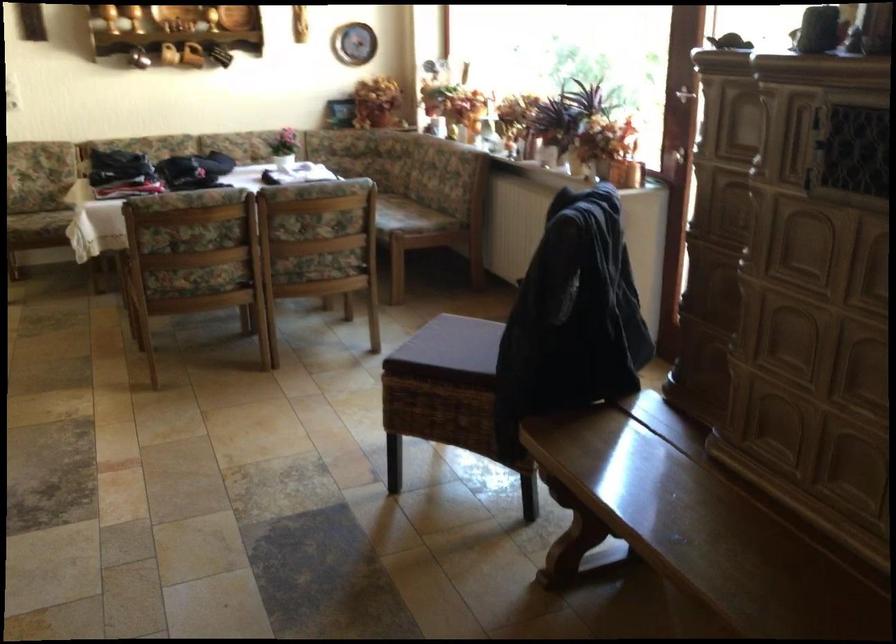
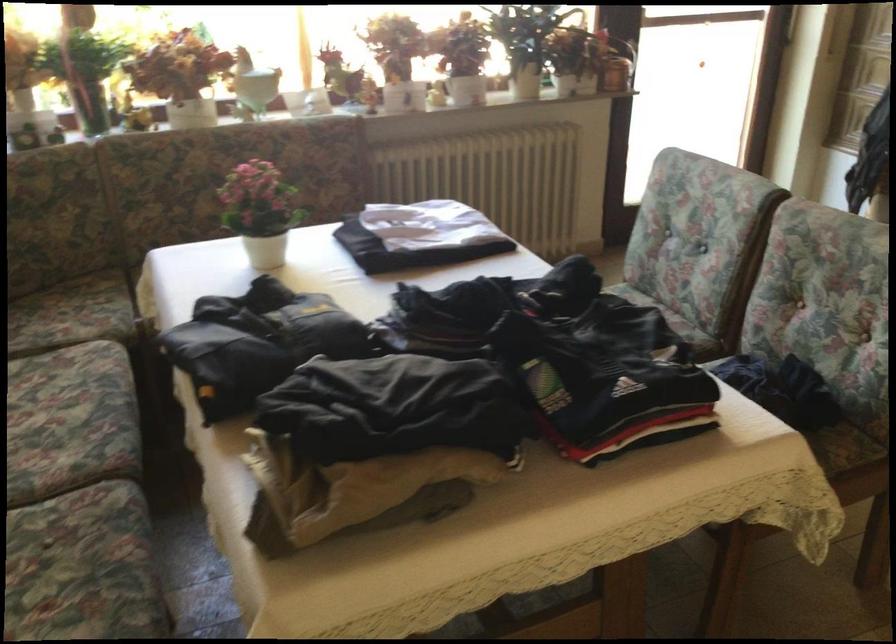
Where in the second image is the point corresponding to [394,84] from the first image?

(83, 71)